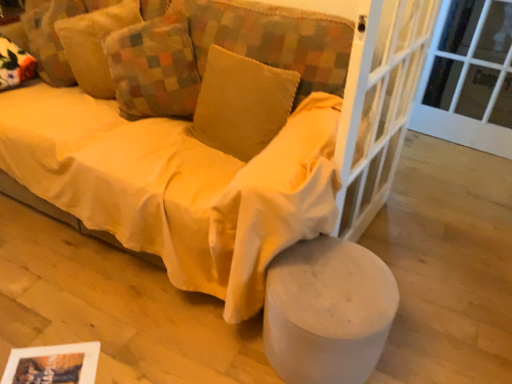
Question: Should I look upward or downward to see matte yellow fabric couch at center?

Choices:
 (A) down
 (B) up

Answer: (B)

Question: From a real-world perspective, does soft yellow cushion at upper left, the third pillow when ordered from right to left, stand above multicolored patchwork pillow at upper left, which ranks as the 2th pillow in right-to-left order?

Choices:
 (A) yes
 (B) no

Answer: (B)

Question: From the image's perspective, is soft yellow cushion at upper left, the third pillow when ordered from right to left, located beneath multicolored patchwork pillow at upper left, which ranks as the 2th pillow in right-to-left order?

Choices:
 (A) yes
 (B) no

Answer: (B)

Question: Considering the relative sizes of soft yellow cushion at upper left, the third pillow when ordered from right to left, and multicolored patchwork pillow at upper left, which ranks as the 2th pillow in right-to-left order, in the image provided, is soft yellow cushion at upper left, the third pillow when ordered from right to left, smaller than multicolored patchwork pillow at upper left, which ranks as the 2th pillow in right-to-left order,?

Choices:
 (A) no
 (B) yes

Answer: (B)

Question: Can you confirm if soft yellow cushion at upper left, the first pillow in the left-to-right sequence, is bigger than multicolored patchwork pillow at upper left, the second pillow positioned from the left?

Choices:
 (A) yes
 (B) no

Answer: (B)

Question: Is soft yellow cushion at upper left, the third pillow when ordered from right to left, completely or partially outside of multicolored patchwork pillow at upper left, the second pillow positioned from the left?

Choices:
 (A) yes
 (B) no

Answer: (A)

Question: Is soft yellow cushion at upper left, the first pillow in the left-to-right sequence, facing towards multicolored patchwork pillow at upper left, the second pillow positioned from the left?

Choices:
 (A) yes
 (B) no

Answer: (A)

Question: Does velvet yellow pillow at center, which is counted as the third pillow, starting from the left, turn towards soft yellow cushion at upper left, the third pillow when ordered from right to left?

Choices:
 (A) no
 (B) yes

Answer: (A)

Question: Considering the relative sizes of velvet yellow pillow at center, which is counted as the third pillow, starting from the left, and soft yellow cushion at upper left, the third pillow when ordered from right to left, in the image provided, is velvet yellow pillow at center, which is counted as the third pillow, starting from the left, smaller than soft yellow cushion at upper left, the third pillow when ordered from right to left,?

Choices:
 (A) no
 (B) yes

Answer: (B)

Question: Can you confirm if velvet yellow pillow at center, which is counted as the third pillow, starting from the left, is taller than soft yellow cushion at upper left, the first pillow in the left-to-right sequence?

Choices:
 (A) no
 (B) yes

Answer: (A)

Question: Considering the relative sizes of velvet yellow pillow at center, the 1th pillow positioned from the right, and soft yellow cushion at upper left, the third pillow when ordered from right to left, in the image provided, is velvet yellow pillow at center, the 1th pillow positioned from the right, bigger than soft yellow cushion at upper left, the third pillow when ordered from right to left,?

Choices:
 (A) no
 (B) yes

Answer: (A)

Question: Is velvet yellow pillow at center, the 1th pillow positioned from the right, turned away from soft yellow cushion at upper left, the third pillow when ordered from right to left?

Choices:
 (A) no
 (B) yes

Answer: (A)

Question: Is velvet yellow pillow at center, the 1th pillow positioned from the right, in front of soft yellow cushion at upper left, the third pillow when ordered from right to left?

Choices:
 (A) yes
 (B) no

Answer: (A)

Question: From a real-world perspective, is matte yellow fabric couch at center physically above white glass screen door at center right?

Choices:
 (A) no
 (B) yes

Answer: (A)